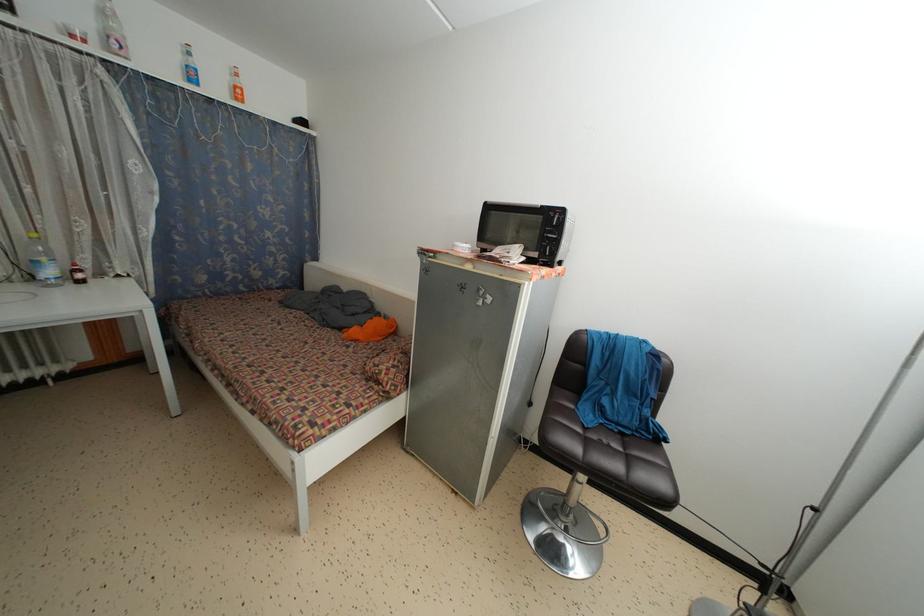
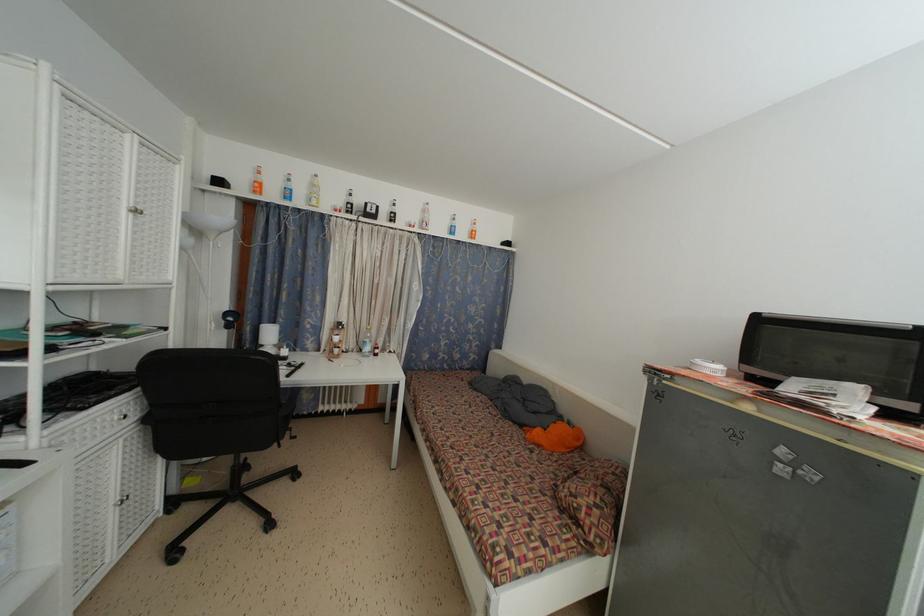
Based on the continuous images, in which direction is the camera rotating?

The camera's rotation is toward left-up.